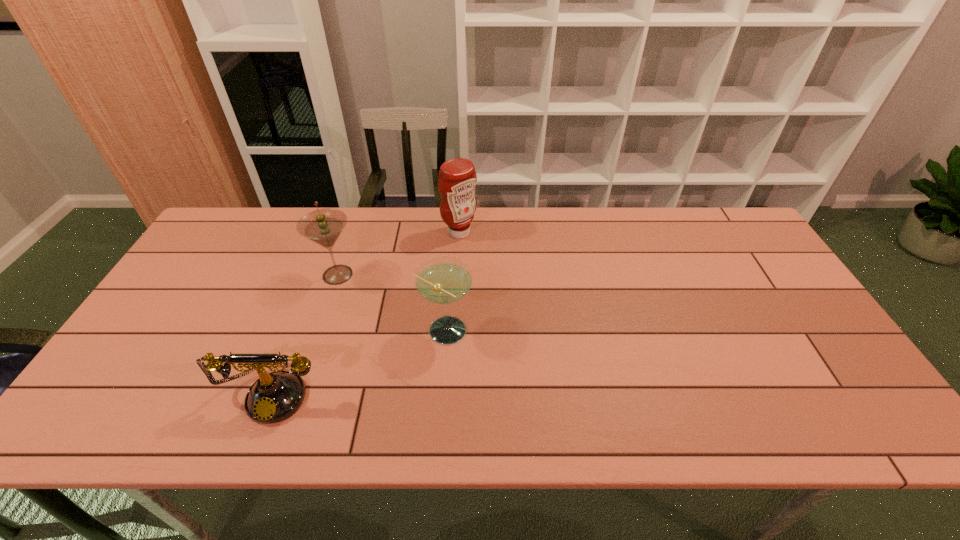
The height and width of the screenshot is (540, 960). Identify the location of object positioned at the far edge. (457, 179).

Where is `object situated at the near edge`? This screenshot has height=540, width=960. object situated at the near edge is located at coordinates (274, 397).

The width and height of the screenshot is (960, 540). What are the coordinates of `free location at the far edge of the desktop` in the screenshot? It's located at (354, 232).

At what (x,y) coordinates should I click in order to perform the action: click on free region at the near edge of the desktop. Please return your answer as a coordinate pair (x, y). Looking at the image, I should click on (451, 419).

Image resolution: width=960 pixels, height=540 pixels. Identify the location of vacant space at the left edge of the desktop. [x=171, y=381].

Where is `vacant space at the right edge of the desktop`? vacant space at the right edge of the desktop is located at coordinates (848, 376).

Image resolution: width=960 pixels, height=540 pixels. What are the coordinates of `vacant area at the far left corner` in the screenshot? It's located at (235, 224).

You are a GUI agent. You are given a task and a screenshot of the screen. Output one action in this format:
    pyautogui.click(x=<x>, y=<y>)
    Task: Click on the free region at the near right corner
    This screenshot has height=540, width=960.
    Given the screenshot: What is the action you would take?
    pyautogui.click(x=822, y=404)

This screenshot has height=540, width=960. In order to click on free space that is in between the left martini and the right martini in this screenshot , I will do `click(391, 303)`.

Locate an element on the screen. Image resolution: width=960 pixels, height=540 pixels. free space between the telephone and the farthest object is located at coordinates (368, 312).